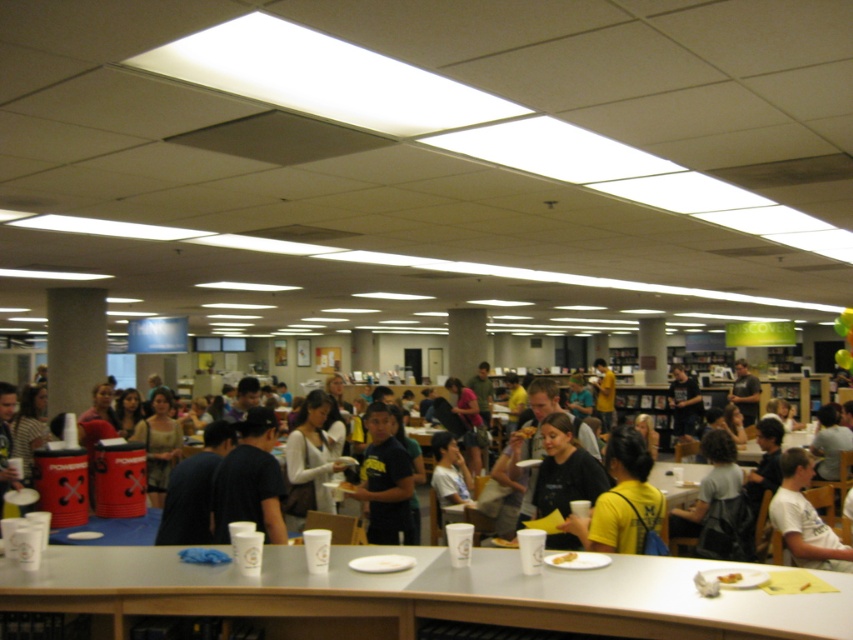
You are standing in the cafeteria and want to pick up an item from the table. The item is located at point A, which is at coordinates point (653, 556), and another item is at point B, coordinates point (363, 493). Which point is closer to you?

Point (653, 556) is closer to the viewer than point (363, 493), so you should reach for the item at point (653, 556) first.